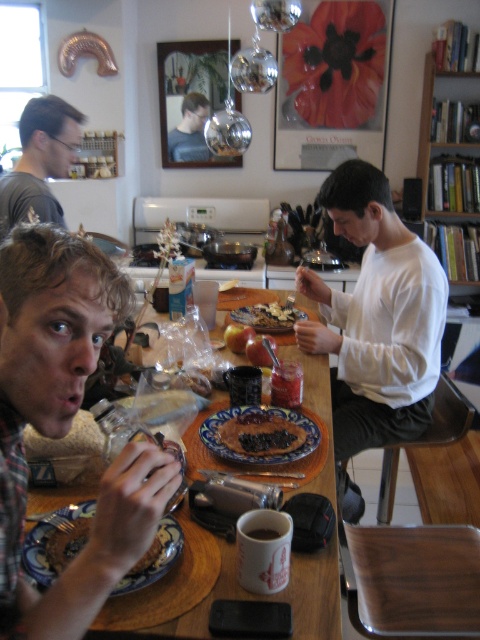
Is blue ceramic plate at lower left positioned behind matte black shirt at upper center?

No, blue ceramic plate at lower left is in front of matte black shirt at upper center.

Which is more to the right, blue ceramic plate at lower left or matte black shirt at upper center?

Positioned to the right is blue ceramic plate at lower left.

Describe the element at coordinates (156, 557) in the screenshot. I see `blue ceramic plate at lower left` at that location.

What are the coordinates of `blue ceramic plate at lower left` in the screenshot? It's located at (156, 557).

Measure the distance between blue glazed plate at center and camera.

blue glazed plate at center and camera are 4.00 feet apart from each other.

Does blue glazed plate at center appear on the left side of blue ceramic plate at lower left?

In fact, blue glazed plate at center is to the right of blue ceramic plate at lower left.

Locate an element on the screen. blue glazed plate at center is located at coordinates click(260, 435).

Can you confirm if plaid shirt at left is positioned below chocolate cake at center?

Yes, plaid shirt at left is below chocolate cake at center.

Is point (66, 308) behind point (288, 324)?

No, it is not.

Locate an element on the screen. plaid shirt at left is located at coordinates (64, 422).